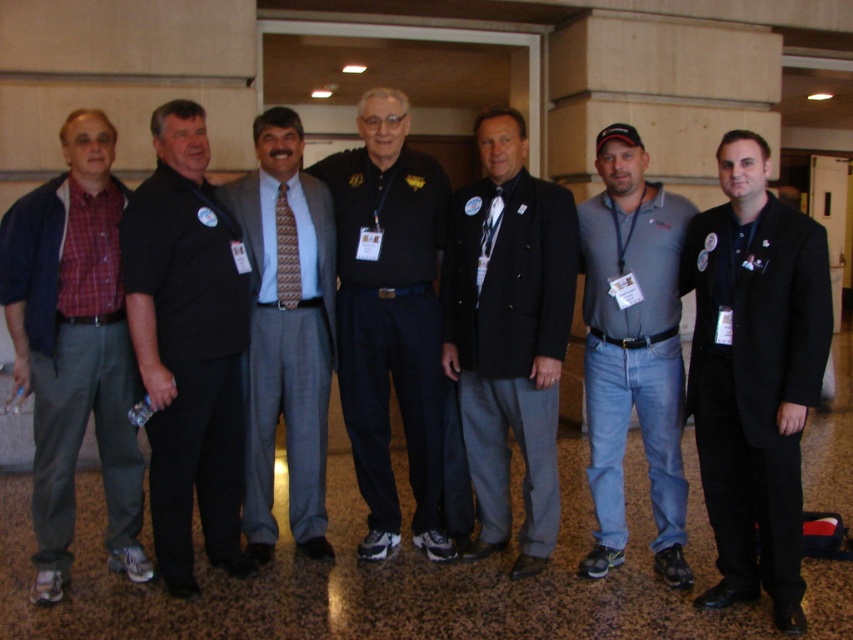
Is point (786, 577) less distant than point (84, 426)?

Yes, point (786, 577) is in front of point (84, 426).

Between point (703, 486) and point (45, 460), which one is positioned behind?

The point (45, 460) is more distant.

Identify the location of black wool coat at center. Image resolution: width=853 pixels, height=640 pixels. (753, 374).

Is black cotton polo shirt at center bigger than orange patterned tie at center?

Indeed, black cotton polo shirt at center has a larger size compared to orange patterned tie at center.

Which of these two, black cotton polo shirt at center or orange patterned tie at center, stands taller?

With more height is black cotton polo shirt at center.

Who is more forward, (415,538) or (277,282)?

Point (277,282)

Identify the location of black cotton polo shirt at center. (390, 317).

Does black wool coat at center have a lesser height compared to orange patterned tie at center?

Incorrect, black wool coat at center's height does not fall short of orange patterned tie at center's.

Can you confirm if black wool coat at center is positioned to the left of orange patterned tie at center?

No, black wool coat at center is not to the left of orange patterned tie at center.

Which is in front, point (752, 136) or point (281, 289)?

Point (752, 136) is in front.

Image resolution: width=853 pixels, height=640 pixels. Identify the location of black wool coat at center. (753, 374).